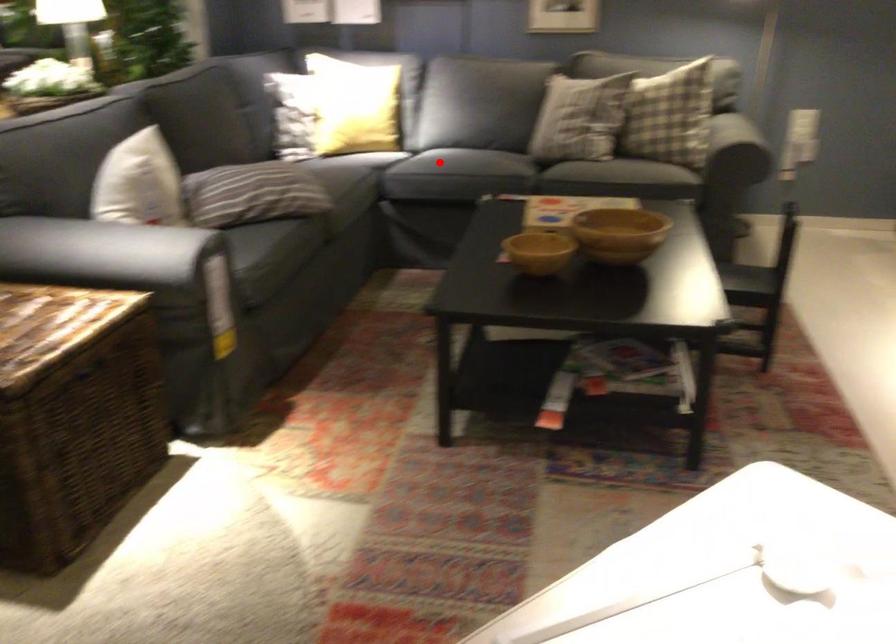
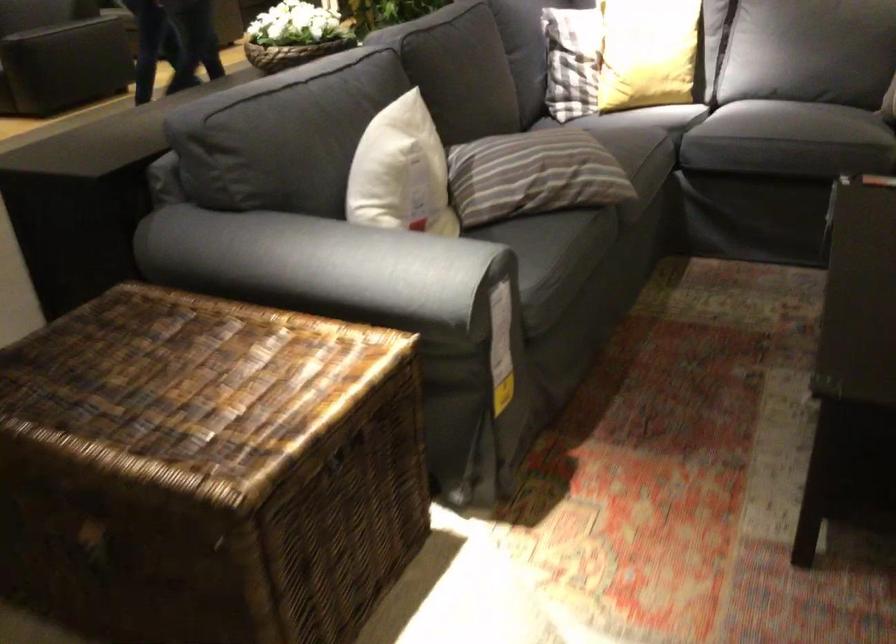
Find the pixel in the second image that matches the highlighted location in the first image.

(768, 122)